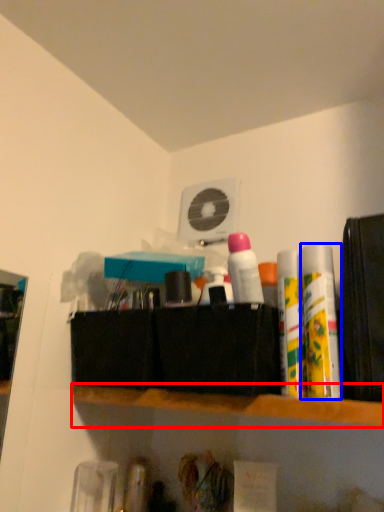
Question: Among these objects, which one is nearest to the camera, shelf (highlighted by a red box) or toiletry (highlighted by a blue box)?

Choices:
 (A) shelf
 (B) toiletry

Answer: (A)